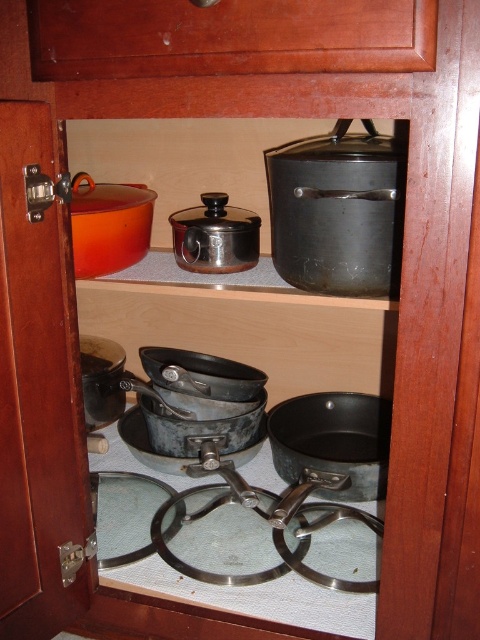
Question: Is metallic glass cookware at center positioned before matte black frying pan at left?

Choices:
 (A) no
 (B) yes

Answer: (B)

Question: Which point is farther from the camera taking this photo?

Choices:
 (A) (244, 212)
 (B) (346, 410)

Answer: (B)

Question: Is black matte frying pan at center closer to the viewer compared to matte black frying pan at left?

Choices:
 (A) no
 (B) yes

Answer: (B)

Question: Which object is farther from the camera taking this photo?

Choices:
 (A) black matte frying pan at center
 (B) satin silver pot at center
 (C) wooden drawer at upper center

Answer: (A)

Question: Among these objects, which one is nearest to the camera?

Choices:
 (A) matte black frying pan at left
 (B) black matte frying pan at center

Answer: (B)

Question: Is satin silver pot at center bigger than matte black frying pan at left?

Choices:
 (A) no
 (B) yes

Answer: (B)